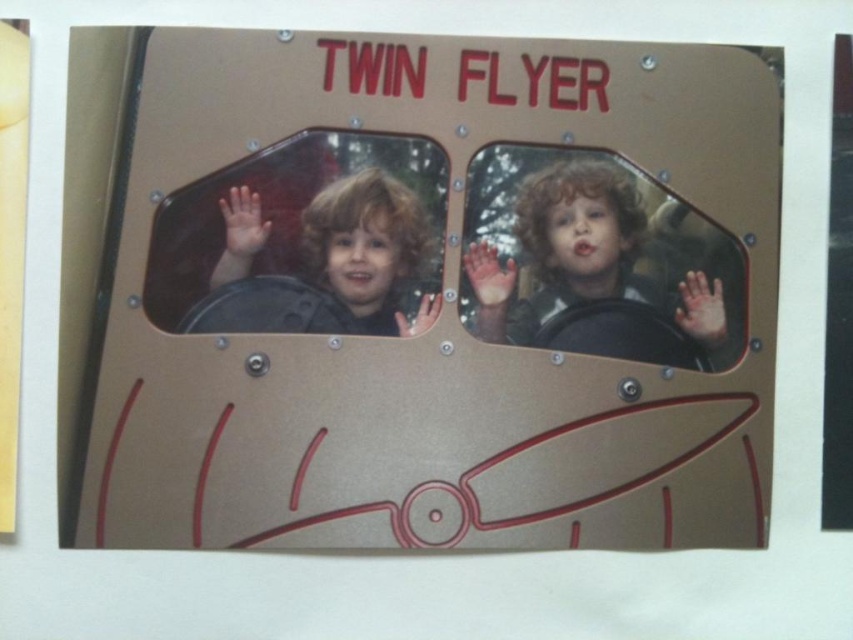
What do you see at coordinates (421, 292) in the screenshot?
I see `metallic gold sign at center` at bounding box center [421, 292].

Is metallic gold sign at center above matte black helmet at left?

No, metallic gold sign at center is not above matte black helmet at left.

Is point (561, 193) positioned before point (241, 324)?

No, (561, 193) is further to viewer.

At what (x,y) coordinates should I click in order to perform the action: click on metallic gold sign at center. Please return your answer as a coordinate pair (x, y). This screenshot has height=640, width=853. Looking at the image, I should click on (421, 292).

Is metallic gold sign at center to the left of matte black steering wheel at center from the viewer's perspective?

Indeed, metallic gold sign at center is positioned on the left side of matte black steering wheel at center.

The height and width of the screenshot is (640, 853). Identify the location of metallic gold sign at center. (421, 292).

Find the location of `metallic gold sign at center`. metallic gold sign at center is located at coordinates (421, 292).

Is matte black steering wheel at center smaller than matte black helmet at left?

No.

Is matte black steering wheel at center taller than matte black helmet at left?

Correct, matte black steering wheel at center is much taller as matte black helmet at left.

Is point (538, 218) less distant than point (244, 321)?

No.

The height and width of the screenshot is (640, 853). Find the location of `matte black steering wheel at center`. matte black steering wheel at center is located at coordinates (589, 259).